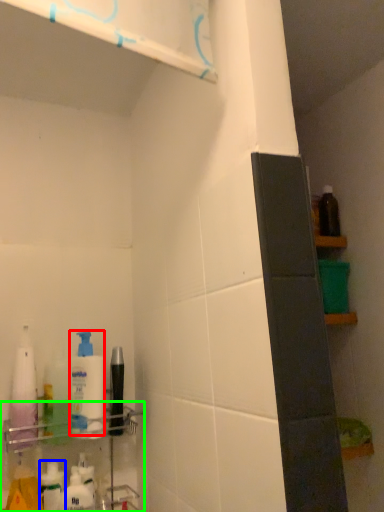
Question: Which object is the farthest from cleaning product (highlighted by a red box)? Choose among these: toiletry (highlighted by a blue box) or shelf (highlighted by a green box).

Choices:
 (A) toiletry
 (B) shelf

Answer: (A)